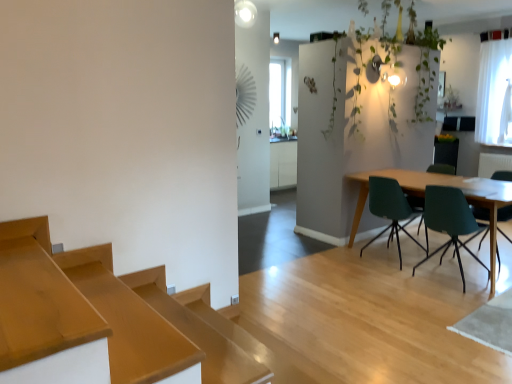
What do you see at coordinates (450, 222) in the screenshot? This screenshot has height=384, width=512. I see `matte green chair at right, arranged as the second chair when viewed from the left` at bounding box center [450, 222].

Looking at this image, what is the approximate width of matte green chair at right, arranged as the second chair when viewed from the left?

It is 52.67 centimeters.

Locate an element on the screen. This screenshot has height=384, width=512. green leafy plant at upper right is located at coordinates (411, 45).

The height and width of the screenshot is (384, 512). Describe the element at coordinates (504, 213) in the screenshot. I see `green matte chair at right, the first chair in the right-to-left sequence` at that location.

The height and width of the screenshot is (384, 512). Describe the element at coordinates (416, 207) in the screenshot. I see `green matte chair at right, marked as the second chair in a right-to-left arrangement` at that location.

At what (x,y) coordinates should I click in order to perform the action: click on matte green chair at right, marked as the 3th chair in a right-to-left arrangement. Please return your answer as a coordinate pair (x, y). This screenshot has width=512, height=384. Looking at the image, I should click on (450, 222).

Is green leafy plant at upper right in contact with green matte chair at right, the fourth chair in the left-to-right sequence?

green leafy plant at upper right and green matte chair at right, the fourth chair in the left-to-right sequence, are clearly separated.

In terms of width, does green leafy plant at upper right look wider or thinner when compared to green matte chair at right, the first chair in the right-to-left sequence?

Considering their sizes, green leafy plant at upper right looks slimmer than green matte chair at right, the first chair in the right-to-left sequence.

How distant is white sheer curtain at upper right from teal plastic chair at center right, the 1th chair positioned from the left?

white sheer curtain at upper right and teal plastic chair at center right, the 1th chair positioned from the left, are 2.21 meters apart.

Is there a large distance between white sheer curtain at upper right and teal plastic chair at center right, the 1th chair positioned from the left?

Yes, white sheer curtain at upper right and teal plastic chair at center right, the 1th chair positioned from the left, are quite far apart.

From the image's perspective, is white sheer curtain at upper right on teal plastic chair at center right, the 1th chair positioned from the left?

Indeed, from the image's perspective, white sheer curtain at upper right is shown above teal plastic chair at center right, the 1th chair positioned from the left.

Based on the photo, considering the relative sizes of white sheer curtain at upper right and teal plastic chair at center right, which is the fourth chair from right to left, in the image provided, is white sheer curtain at upper right thinner than teal plastic chair at center right, which is the fourth chair from right to left,?

Yes.

The width and height of the screenshot is (512, 384). What are the coordinates of `plant above the green matte chair at right, the 3th chair when ordered from left to right (from the image's perspective)` in the screenshot? It's located at (411, 45).

Considering the relative positions of green leafy plant at upper right and green matte chair at right, marked as the second chair in a right-to-left arrangement, in the image provided, is green leafy plant at upper right to the right of green matte chair at right, marked as the second chair in a right-to-left arrangement, from the viewer's perspective?

No.

Consider the image. Is green leafy plant at upper right further to the viewer compared to green matte chair at right, the 3th chair when ordered from left to right?

No, the depth of green leafy plant at upper right is less than that of green matte chair at right, the 3th chair when ordered from left to right.

Is point (421, 50) closer or farther from the camera than point (428, 169)?

Clearly, point (421, 50) is closer to the camera than point (428, 169).

In the scene shown: Who is more distant, wooden table at right or green matte chair at right, the fourth chair in the left-to-right sequence?

green matte chair at right, the fourth chair in the left-to-right sequence, is further away from the camera.

From the picture: Do you think wooden table at right is within green matte chair at right, the first chair in the right-to-left sequence, or outside of it?

wooden table at right exists outside the volume of green matte chair at right, the first chair in the right-to-left sequence.

You are a GUI agent. You are given a task and a screenshot of the screen. Output one action in this format:
    pyautogui.click(x=<x>, y=<y>)
    Task: Click on the table below the green matte chair at right, the fourth chair in the left-to-right sequence (from a real-world perspective)
    The image size is (512, 384).
    Given the screenshot: What is the action you would take?
    pyautogui.click(x=442, y=185)

Is point (478, 112) positioned after point (481, 216)?

Yes, it is behind point (481, 216).

How far apart are white sheer curtain at upper right and green matte chair at right, the first chair in the right-to-left sequence?

7.21 feet.

From a real-world perspective, is white sheer curtain at upper right positioned above or below green matte chair at right, the fourth chair in the left-to-right sequence?

In terms of real-world spatial position, white sheer curtain at upper right is above green matte chair at right, the fourth chair in the left-to-right sequence.

Based on the photo, from the image's perspective, is white sheer curtain at upper right located above or below green matte chair at right, the fourth chair in the left-to-right sequence?

From the image's perspective, white sheer curtain at upper right appears above green matte chair at right, the fourth chair in the left-to-right sequence.

Visually, is green matte chair at right, the 3th chair when ordered from left to right, positioned to the left or to the right of matte green chair at right, arranged as the second chair when viewed from the left?

→ green matte chair at right, the 3th chair when ordered from left to right, is to the right of matte green chair at right, arranged as the second chair when viewed from the left.

From the image's perspective, is green matte chair at right, the 3th chair when ordered from left to right, located above or below matte green chair at right, arranged as the second chair when viewed from the left?

From the image's perspective, green matte chair at right, the 3th chair when ordered from left to right, appears above matte green chair at right, arranged as the second chair when viewed from the left.

Can you confirm if green matte chair at right, marked as the second chair in a right-to-left arrangement, is thinner than matte green chair at right, arranged as the second chair when viewed from the left?

Incorrect, the width of green matte chair at right, marked as the second chair in a right-to-left arrangement, is not less than that of matte green chair at right, arranged as the second chair when viewed from the left.

Which object is closer to the camera, green matte chair at right, marked as the second chair in a right-to-left arrangement, or matte green chair at right, arranged as the second chair when viewed from the left?

matte green chair at right, arranged as the second chair when viewed from the left, is closer to the camera.

Is wooden table at right aimed at green leafy plant at upper right?

No, wooden table at right is not turned towards green leafy plant at upper right.

Are wooden table at right and green leafy plant at upper right beside each other?

No, wooden table at right is not beside green leafy plant at upper right.

Does wooden table at right have a lesser height compared to green leafy plant at upper right?

Indeed, wooden table at right has a lesser height compared to green leafy plant at upper right.

Locate an element on the screen. the 2nd chair in front when counting from the green leafy plant at upper right is located at coordinates (504, 213).

This screenshot has width=512, height=384. Find the location of `the 4th chair directly beneath the white sheer curtain at upper right (from a real-world perspective)`. the 4th chair directly beneath the white sheer curtain at upper right (from a real-world perspective) is located at coordinates (391, 209).

Considering their positions, is wooden table at right positioned further to matte green chair at right, arranged as the second chair when viewed from the left, than teal plastic chair at center right, which is the fourth chair from right to left?

teal plastic chair at center right, which is the fourth chair from right to left, lies further to matte green chair at right, arranged as the second chair when viewed from the left, than the other object.

Considering their positions, is green matte chair at right, marked as the second chair in a right-to-left arrangement, positioned closer to teal plastic chair at center right, the 1th chair positioned from the left, than white sheer curtain at upper right?

green matte chair at right, marked as the second chair in a right-to-left arrangement, is positioned closer to the anchor teal plastic chair at center right, the 1th chair positioned from the left.

From the picture: From the image, which object appears to be nearer to green leafy plant at upper right, green matte chair at right, marked as the second chair in a right-to-left arrangement, or white sheer curtain at upper right?

Based on the image, white sheer curtain at upper right appears to be nearer to green leafy plant at upper right.

Based on their spatial positions, is green matte chair at right, marked as the second chair in a right-to-left arrangement, or white sheer curtain at upper right further from matte green chair at right, marked as the 3th chair in a right-to-left arrangement?

white sheer curtain at upper right.

When comparing their distances from white sheer curtain at upper right, does green matte chair at right, the fourth chair in the left-to-right sequence, or teal plastic chair at center right, which is the fourth chair from right to left, seem closer?

green matte chair at right, the fourth chair in the left-to-right sequence, is positioned closer to the anchor white sheer curtain at upper right.

Considering their positions, is green matte chair at right, marked as the second chair in a right-to-left arrangement, positioned closer to white sheer curtain at upper right than wooden table at right?

green matte chair at right, marked as the second chair in a right-to-left arrangement.

When comparing their distances from teal plastic chair at center right, the 1th chair positioned from the left, does matte green chair at right, marked as the 3th chair in a right-to-left arrangement, or green matte chair at right, marked as the second chair in a right-to-left arrangement, seem further?

green matte chair at right, marked as the second chair in a right-to-left arrangement, is positioned further to the anchor teal plastic chair at center right, the 1th chair positioned from the left.

Based on the photo, which object lies further to the anchor point teal plastic chair at center right, the 1th chair positioned from the left, white sheer curtain at upper right or wooden table at right?

white sheer curtain at upper right is positioned further to the anchor teal plastic chair at center right, the 1th chair positioned from the left.

Locate an element on the screen. The image size is (512, 384). plant between wooden table at right and white sheer curtain at upper right in the front-back direction is located at coordinates (411, 45).

Locate an element on the screen. chair that lies between green leafy plant at upper right and teal plastic chair at center right, the 1th chair positioned from the left, from top to bottom is located at coordinates (416, 207).

At what (x,y) coordinates should I click in order to perform the action: click on table between teal plastic chair at center right, the 1th chair positioned from the left, and green matte chair at right, the fourth chair in the left-to-right sequence, in the horizontal direction. Please return your answer as a coordinate pair (x, y). This screenshot has height=384, width=512. Looking at the image, I should click on (442, 185).

Find the location of a particular element. This screenshot has height=384, width=512. table situated between matte green chair at right, arranged as the second chair when viewed from the left, and green matte chair at right, the fourth chair in the left-to-right sequence, from left to right is located at coordinates (442, 185).